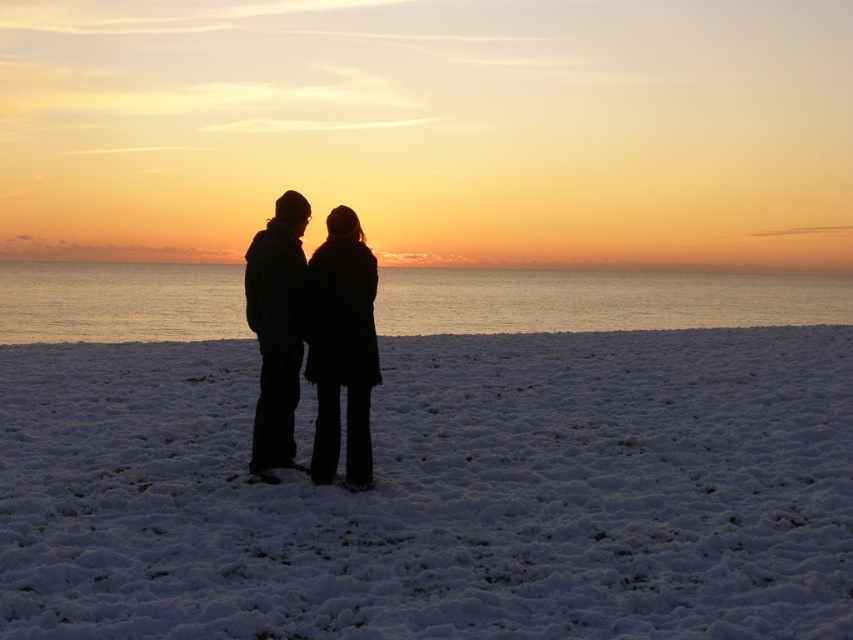
Can you confirm if white fluffy snow at center is positioned below black fuzzy coat at center?

Correct, white fluffy snow at center is located below black fuzzy coat at center.

Locate an element on the screen. white fluffy snow at center is located at coordinates (439, 493).

Which is in front, point (845, 552) or point (271, 422)?

Point (845, 552)

Where is `white fluffy snow at center`? white fluffy snow at center is located at coordinates (439, 493).

Between black fuzzy coat at center and black matte coat at center, which one is positioned lower?

black fuzzy coat at center is below.

Is black fuzzy coat at center shorter than black matte coat at center?

Yes.

This screenshot has width=853, height=640. I want to click on black fuzzy coat at center, so click(312, 337).

Is white fluffy snow at center smaller than black matte coat at center?

Actually, white fluffy snow at center might be larger than black matte coat at center.

Between white fluffy snow at center and black matte coat at center, which one appears on the right side from the viewer's perspective?

white fluffy snow at center is more to the right.

Identify the location of white fluffy snow at center. This screenshot has width=853, height=640. tap(439, 493).